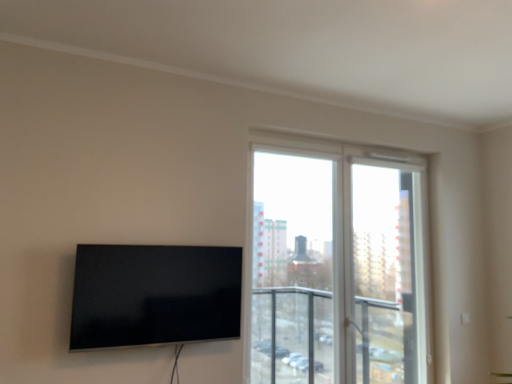
Question: Is transparent glass screen door at upper right located within transparent glass window at center?

Choices:
 (A) yes
 (B) no

Answer: (A)

Question: Is the position of transparent glass window at center less distant than that of transparent glass screen door at upper right?

Choices:
 (A) yes
 (B) no

Answer: (A)

Question: Does transparent glass window at center have a larger size compared to transparent glass screen door at upper right?

Choices:
 (A) yes
 (B) no

Answer: (A)

Question: From the image's perspective, is transparent glass window at center on top of transparent glass screen door at upper right?

Choices:
 (A) yes
 (B) no

Answer: (A)

Question: Can you confirm if transparent glass window at center is smaller than transparent glass screen door at upper right?

Choices:
 (A) yes
 (B) no

Answer: (B)

Question: Considering the positions of transparent glass screen door at upper right and matte black tv at left in the image, is transparent glass screen door at upper right taller or shorter than matte black tv at left?

Choices:
 (A) short
 (B) tall

Answer: (B)

Question: Looking at their shapes, would you say transparent glass screen door at upper right is wider or thinner than matte black tv at left?

Choices:
 (A) thin
 (B) wide

Answer: (B)

Question: Based on their sizes in the image, would you say transparent glass screen door at upper right is bigger or smaller than matte black tv at left?

Choices:
 (A) small
 (B) big

Answer: (B)

Question: Considering the relative positions of transparent glass screen door at upper right and matte black tv at left in the image provided, is transparent glass screen door at upper right to the left or to the right of matte black tv at left?

Choices:
 (A) right
 (B) left

Answer: (A)

Question: In terms of width, does matte black tv at left look wider or thinner when compared to transparent glass window at center?

Choices:
 (A) thin
 (B) wide

Answer: (A)

Question: From a real-world perspective, relative to transparent glass window at center, is matte black tv at left vertically above or below?

Choices:
 (A) above
 (B) below

Answer: (B)

Question: Looking at the image, does matte black tv at left seem bigger or smaller compared to transparent glass window at center?

Choices:
 (A) big
 (B) small

Answer: (B)

Question: Choose the correct answer: Is matte black tv at left inside transparent glass window at center or outside it?

Choices:
 (A) outside
 (B) inside

Answer: (A)

Question: Is point (415, 185) positioned closer to the camera than point (403, 334)?

Choices:
 (A) closer
 (B) farther

Answer: (B)

Question: From the image's perspective, is transparent glass screen door at upper right located above or below transparent glass window at center?

Choices:
 (A) below
 (B) above

Answer: (A)